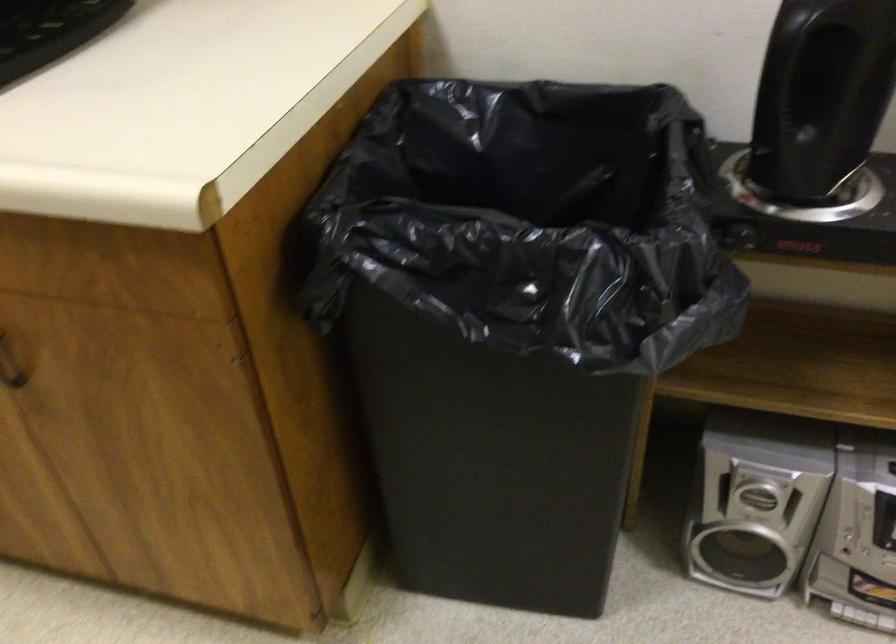
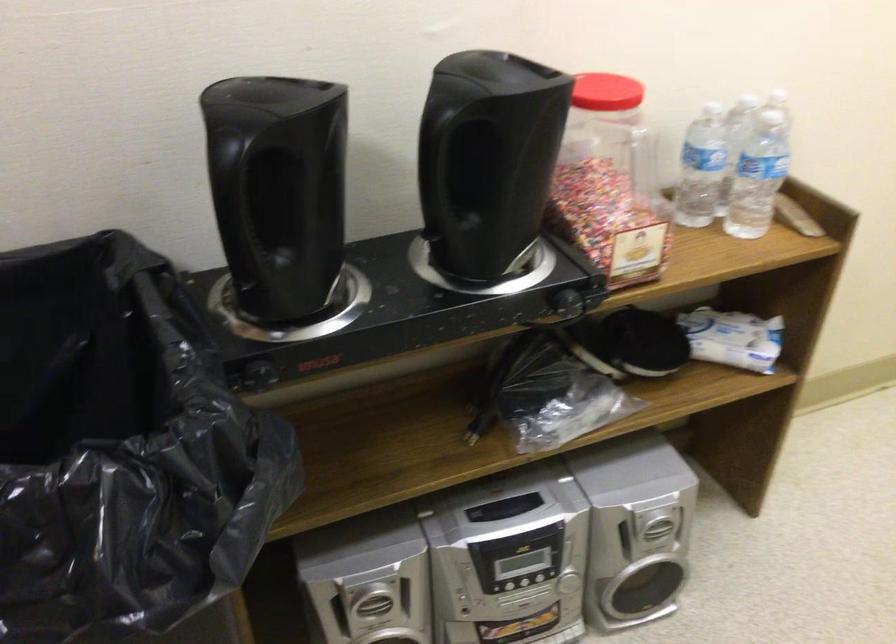
Locate, in the second image, the point that corresponds to the point at 735,230 in the first image.

(259, 375)